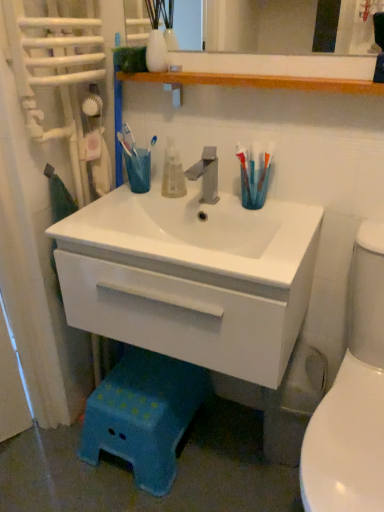
Question: Does translucent plastic toothbrush at right have a greater height compared to translucent plastic mouthwash at center?

Choices:
 (A) yes
 (B) no

Answer: (A)

Question: Does translucent plastic toothbrush at right have a smaller size compared to translucent plastic mouthwash at center?

Choices:
 (A) yes
 (B) no

Answer: (A)

Question: Is translucent plastic toothbrush at right positioned behind translucent plastic mouthwash at center?

Choices:
 (A) no
 (B) yes

Answer: (A)

Question: Is translucent plastic toothbrush at right beside translucent plastic mouthwash at center?

Choices:
 (A) yes
 (B) no

Answer: (B)

Question: Is translucent plastic toothbrush at right turned away from translucent plastic mouthwash at center?

Choices:
 (A) yes
 (B) no

Answer: (B)

Question: In terms of width, does white glossy toilet at right look wider or thinner when compared to translucent plastic mouthwash at center?

Choices:
 (A) wide
 (B) thin

Answer: (A)

Question: Would you say white glossy toilet at right is to the left or to the right of translucent plastic mouthwash at center in the picture?

Choices:
 (A) left
 (B) right

Answer: (B)

Question: Considering the positions of white glossy toilet at right and translucent plastic mouthwash at center in the image, is white glossy toilet at right bigger or smaller than translucent plastic mouthwash at center?

Choices:
 (A) big
 (B) small

Answer: (A)

Question: Does point (362, 415) appear closer or farther from the camera than point (178, 187)?

Choices:
 (A) farther
 (B) closer

Answer: (B)

Question: Is translucent plastic mouthwash at center wider or thinner than white glossy cabinet at center?

Choices:
 (A) wide
 (B) thin

Answer: (B)

Question: Which is correct: translucent plastic mouthwash at center is inside white glossy cabinet at center, or outside of it?

Choices:
 (A) outside
 (B) inside

Answer: (A)

Question: Based on their sizes in the image, would you say translucent plastic mouthwash at center is bigger or smaller than white glossy cabinet at center?

Choices:
 (A) small
 (B) big

Answer: (A)

Question: Is translucent plastic mouthwash at center in front of or behind white glossy cabinet at center in the image?

Choices:
 (A) front
 (B) behind

Answer: (B)

Question: From the image's perspective, is translucent plastic toothbrush at right located above or below satin nickel faucet at center?

Choices:
 (A) above
 (B) below

Answer: (A)

Question: In terms of width, does translucent plastic toothbrush at right look wider or thinner when compared to satin nickel faucet at center?

Choices:
 (A) thin
 (B) wide

Answer: (A)